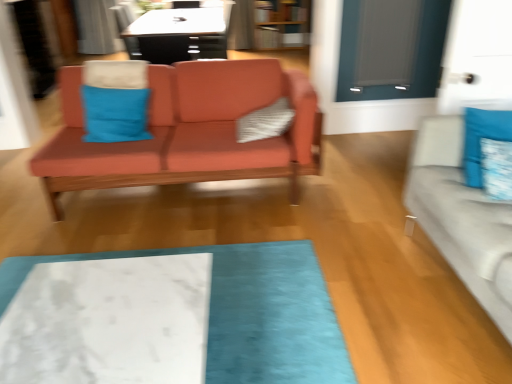
Question: Does white textured pillow at center, the 3th pillow in the right-to-left sequence, have a greater width compared to matte gray glass door at upper right?

Choices:
 (A) no
 (B) yes

Answer: (B)

Question: Is white textured pillow at center, the 3th pillow in the right-to-left sequence, to the right of matte gray glass door at upper right from the viewer's perspective?

Choices:
 (A) yes
 (B) no

Answer: (B)

Question: From the image's perspective, is white textured pillow at center, the 3th pillow in the right-to-left sequence, located above matte gray glass door at upper right?

Choices:
 (A) yes
 (B) no

Answer: (B)

Question: Is white textured pillow at center, the 3th pillow in the right-to-left sequence, not near matte gray glass door at upper right?

Choices:
 (A) no
 (B) yes

Answer: (B)

Question: Does white textured pillow at center, marked as the 2th pillow in a left-to-right arrangement, have a lesser width compared to matte gray glass door at upper right?

Choices:
 (A) no
 (B) yes

Answer: (A)

Question: Is white textured pillow at center, marked as the 2th pillow in a left-to-right arrangement, completely or partially outside of matte gray glass door at upper right?

Choices:
 (A) yes
 (B) no

Answer: (A)

Question: Does blue fabric pillow at right, arranged as the first pillow when viewed from the right, have a lesser height compared to matte gray glass door at upper right?

Choices:
 (A) yes
 (B) no

Answer: (A)

Question: Does blue fabric pillow at right, which is the 4th pillow from left to right, come behind matte gray glass door at upper right?

Choices:
 (A) no
 (B) yes

Answer: (A)

Question: Does blue fabric pillow at right, arranged as the first pillow when viewed from the right, have a greater height compared to matte gray glass door at upper right?

Choices:
 (A) no
 (B) yes

Answer: (A)

Question: Is blue fabric pillow at right, arranged as the first pillow when viewed from the right, not within matte gray glass door at upper right?

Choices:
 (A) no
 (B) yes

Answer: (B)

Question: Is blue fabric pillow at right, which is the 4th pillow from left to right, at the right side of matte gray glass door at upper right?

Choices:
 (A) yes
 (B) no

Answer: (A)

Question: Can matte gray glass door at upper right be found inside blue fabric pillow at right, which is the 4th pillow from left to right?

Choices:
 (A) yes
 (B) no

Answer: (B)

Question: Is the depth of white marble mat at lower center greater than that of matte gray glass door at upper right?

Choices:
 (A) yes
 (B) no

Answer: (B)